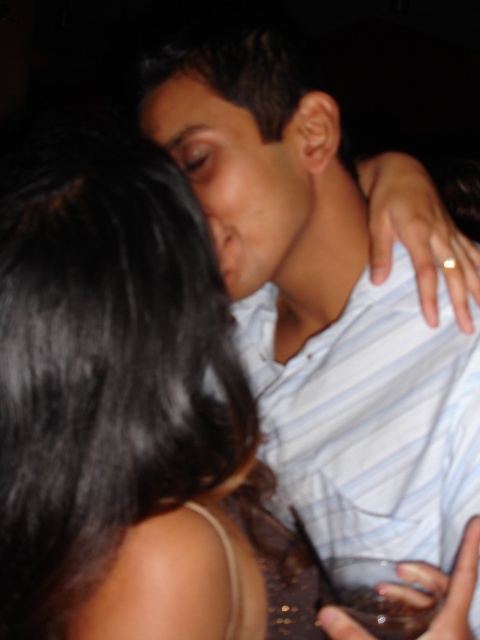
Question: Where is white striped shirt at center located in relation to matte skin forehead at upper center in the image?

Choices:
 (A) right
 (B) left

Answer: (A)

Question: Among these objects, which one is nearest to the camera?

Choices:
 (A) matte skin forehead at upper center
 (B) white striped shirt at center

Answer: (B)

Question: Among these objects, which one is farthest from the camera?

Choices:
 (A) matte skin forehead at upper center
 (B) white striped shirt at center

Answer: (A)

Question: Does white striped shirt at center have a larger size compared to matte skin forehead at upper center?

Choices:
 (A) yes
 (B) no

Answer: (A)

Question: Which point is closer to the camera taking this photo?

Choices:
 (A) tap(336, 376)
 (B) tap(210, 97)

Answer: (B)

Question: Does white striped shirt at center have a lesser width compared to matte skin forehead at upper center?

Choices:
 (A) yes
 (B) no

Answer: (B)